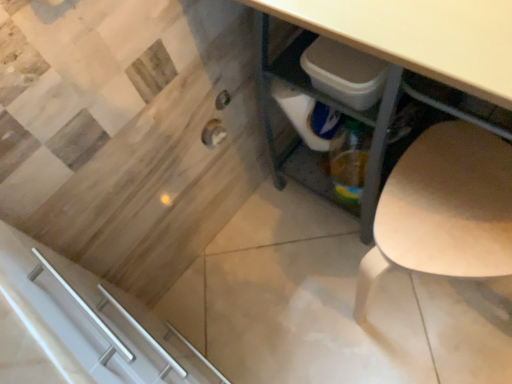
What are the coordinates of `matte white desk at center` in the screenshot? It's located at (415, 50).

This screenshot has height=384, width=512. Describe the element at coordinates (415, 50) in the screenshot. I see `matte white desk at center` at that location.

Image resolution: width=512 pixels, height=384 pixels. Find the location of `light wood chair at lower right`. light wood chair at lower right is located at coordinates (444, 209).

This screenshot has width=512, height=384. Describe the element at coordinates (444, 209) in the screenshot. I see `light wood chair at lower right` at that location.

Where is `matte white desk at center`? Image resolution: width=512 pixels, height=384 pixels. matte white desk at center is located at coordinates (415, 50).

Is matte white desk at center at the left side of light wood chair at lower right?

Correct, you'll find matte white desk at center to the left of light wood chair at lower right.

Considering the relative positions of matte white desk at center and light wood chair at lower right in the image provided, is matte white desk at center in front of light wood chair at lower right?

Yes.

Does point (431, 0) lie in front of point (420, 198)?

That is True.

From the image's perspective, is matte white desk at center located above or below light wood chair at lower right?

matte white desk at center is situated higher than light wood chair at lower right in the image.

From a real-world perspective, is matte white desk at center physically below light wood chair at lower right?

No.

Based on the photo, considering the relative sizes of matte white desk at center and light wood chair at lower right in the image provided, is matte white desk at center wider than light wood chair at lower right?

Yes.

Considering the relative sizes of matte white desk at center and light wood chair at lower right in the image provided, is matte white desk at center taller than light wood chair at lower right?

Correct, matte white desk at center is much taller as light wood chair at lower right.

Is matte white desk at center smaller than light wood chair at lower right?

No, matte white desk at center is not smaller than light wood chair at lower right.

Would you say matte white desk at center contains light wood chair at lower right?

Yes, light wood chair at lower right is inside matte white desk at center.

Is matte white desk at center placed right next to light wood chair at lower right?

No, matte white desk at center is not touching light wood chair at lower right.

Is matte white desk at center looking in the opposite direction of light wood chair at lower right?

That's right, matte white desk at center is facing away from light wood chair at lower right.

Can you tell me how much matte white desk at center and light wood chair at lower right differ in facing direction?

The facing directions of matte white desk at center and light wood chair at lower right are 15.9 degrees apart.

Measure the distance from matte white desk at center to light wood chair at lower right.

They are 9.04 inches apart.

Locate an element on the screen. The width and height of the screenshot is (512, 384). chair that is on the right side of matte white desk at center is located at coordinates click(444, 209).

Is light wood chair at lower right at the left side of matte white desk at center?

No.

Is the depth of light wood chair at lower right greater than that of matte white desk at center?

Yes, light wood chair at lower right is further from the viewer.

Which point is more forward, (497,251) or (442,59)?

The point (442,59) is more forward.

From the image's perspective, would you say light wood chair at lower right is positioned over matte white desk at center?

No, from the image's perspective, light wood chair at lower right is not over matte white desk at center.

From a real-world perspective, between light wood chair at lower right and matte white desk at center, who is vertically lower?

light wood chair at lower right.

Does light wood chair at lower right have a lesser width compared to matte white desk at center?

Indeed, light wood chair at lower right has a lesser width compared to matte white desk at center.

Does light wood chair at lower right have a greater height compared to matte white desk at center?

In fact, light wood chair at lower right may be shorter than matte white desk at center.

Which of these two, light wood chair at lower right or matte white desk at center, is bigger?

matte white desk at center.

Does light wood chair at lower right contain matte white desk at center?

No, matte white desk at center is not a part of light wood chair at lower right.

Are light wood chair at lower right and matte white desk at center located far from each other?

Actually, light wood chair at lower right and matte white desk at center are a little close together.

Is light wood chair at lower right oriented towards matte white desk at center?

Yes, light wood chair at lower right faces towards matte white desk at center.

Find the location of `chair below the matte white desk at center (from the image's perspective)`. chair below the matte white desk at center (from the image's perspective) is located at coordinates (444, 209).

I want to click on chair on the right of the matte white desk at center, so click(444, 209).

In order to click on desk located above the light wood chair at lower right (from a real-world perspective) in this screenshot , I will do `click(415, 50)`.